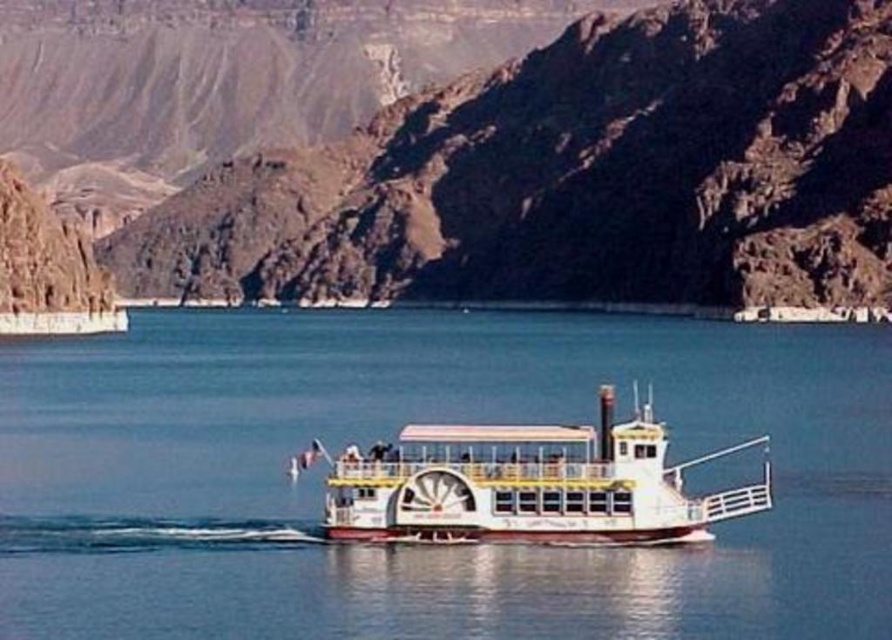
You are a passenger on the white polished wood cruise ship at center and want to take a photo of the brown rocky mountain at center from the highest point on the ship. Is the top of the cruise ship taller than the mountain?

The brown rocky mountain at center is taller than the white polished wood cruise ship at center, so the top of the cruise ship is not taller than the mountain. Therefore, you can still take a photo of the mountain from the highest point on the ship, but the mountain will appear taller in the frame.

You are a passenger on the white polished wood cruise ship at center and want to take a photo of the brown rocky mountain at center. In which direction should you point your camera?

You should point your camera to the right to capture the brown rocky mountain at center, as it is located to the right of the white polished wood cruise ship at center.

You are a photographer planning to capture the white glossy water at center and the white polished wood cruise ship at center in a single shot. Given that your camera can only focus on one object at a time, which object should you prioritize focusing on to ensure it appears larger in the photo?

The white glossy water at center is bigger than the white polished wood cruise ship at center, so you should prioritize focusing on the white glossy water at center to ensure it appears larger in the photo.